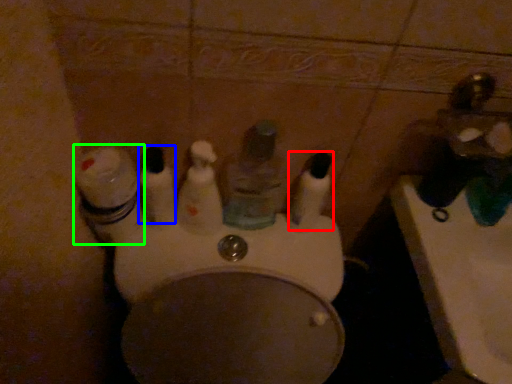
Question: Based on their relative distances, which object is farther from mouthwash (highlighted by a red box)? Choose from mouthwash (highlighted by a blue box) and toiletry (highlighted by a green box).

Choices:
 (A) mouthwash
 (B) toiletry

Answer: (B)